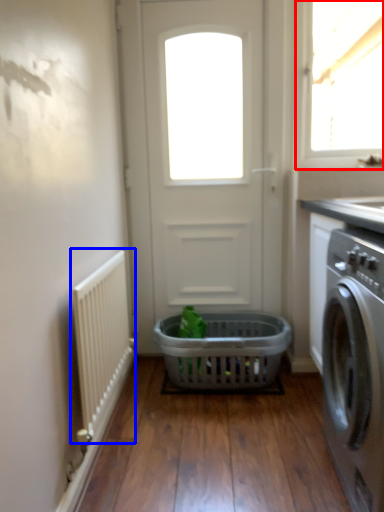
Question: Among these objects, which one is farthest to the camera, window (highlighted by a red box) or radiator (highlighted by a blue box)?

Choices:
 (A) window
 (B) radiator

Answer: (A)